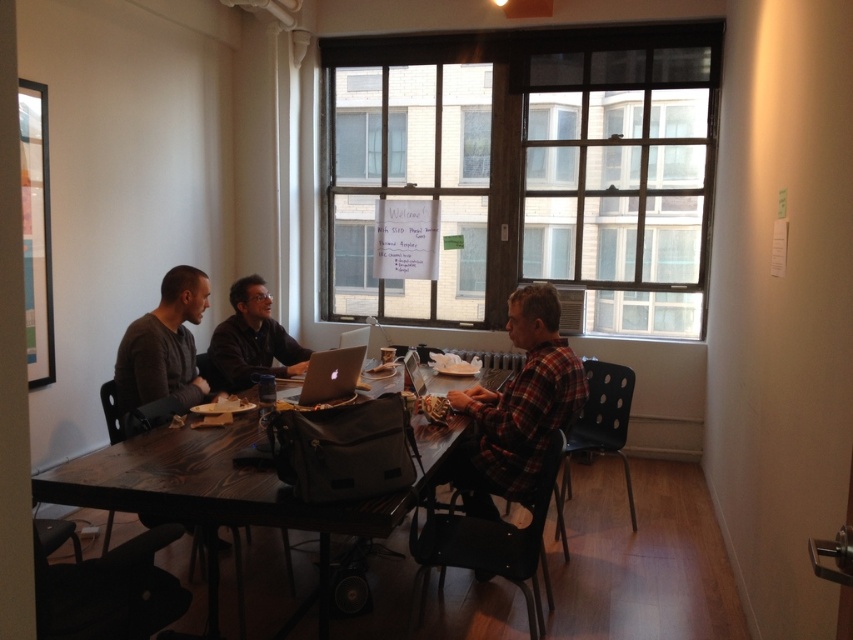
Does dark gray sweater at center have a smaller size compared to silver metallic laptop at center?

No.

Identify the location of dark gray sweater at center. (251, 340).

Is point (257, 348) more distant than point (345, 355)?

Yes, point (257, 348) is behind point (345, 355).

At what (x,y) coordinates should I click in order to perform the action: click on dark gray sweater at center. Please return your answer as a coordinate pair (x, y). Looking at the image, I should click on (251, 340).

Based on the photo, is whiteboard at upper center to the left of silver metallic laptop at center from the viewer's perspective?

Correct, you'll find whiteboard at upper center to the left of silver metallic laptop at center.

Which of these two, whiteboard at upper center or silver metallic laptop at center, stands taller?

whiteboard at upper center

This screenshot has width=853, height=640. What do you see at coordinates (352, 257) in the screenshot?
I see `whiteboard at upper center` at bounding box center [352, 257].

Where is `whiteboard at upper center`? This screenshot has height=640, width=853. whiteboard at upper center is located at coordinates (352, 257).

Can you confirm if dark gray sweater at left is positioned to the left of silver metallic laptop at center?

Correct, you'll find dark gray sweater at left to the left of silver metallic laptop at center.

In the scene shown: Can you confirm if dark gray sweater at left is positioned to the right of silver metallic laptop at center?

In fact, dark gray sweater at left is to the left of silver metallic laptop at center.

What do you see at coordinates (163, 346) in the screenshot?
I see `dark gray sweater at left` at bounding box center [163, 346].

Where is `dark gray sweater at left`? Image resolution: width=853 pixels, height=640 pixels. dark gray sweater at left is located at coordinates (163, 346).